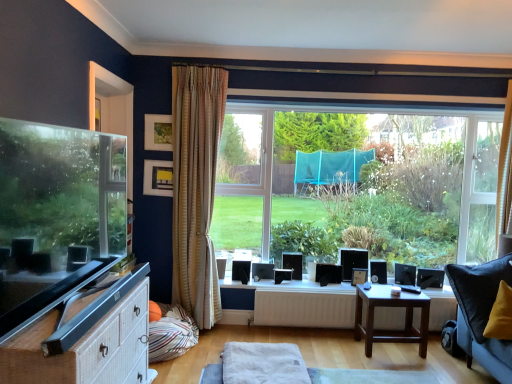
Identify the location of vacant space in front of brown wooden table at lower right. (407, 366).